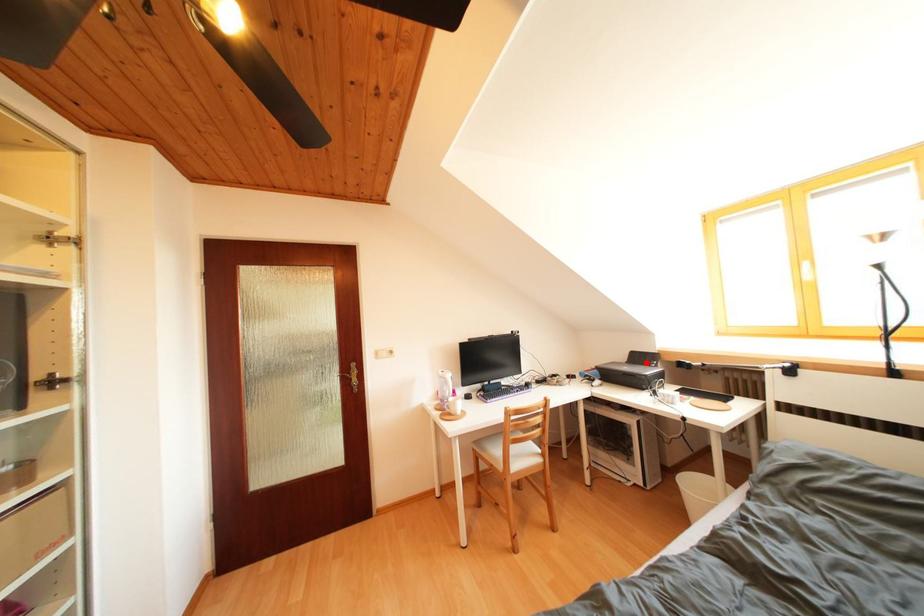
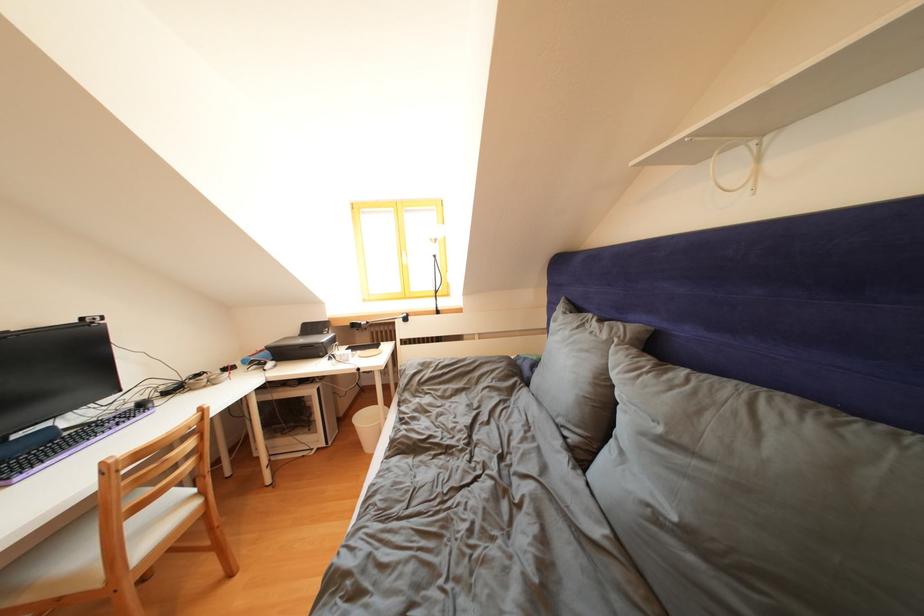
Locate, in the second image, the point that corresponds to the highlighted location in the first image.

(319, 333)